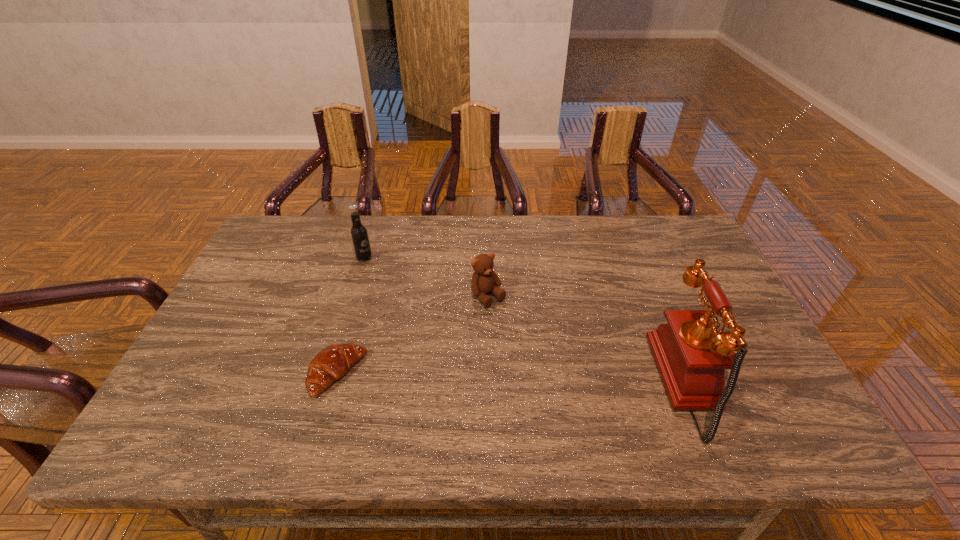
At what (x,y) coordinates should I click in order to perform the action: click on free space that satisfies the following two spatial constraints: 1. on the front side of the crescent roll; 2. on the dial of the rightmost object. Please return your answer as a coordinate pair (x, y). Image resolution: width=960 pixels, height=540 pixels. Looking at the image, I should click on (334, 384).